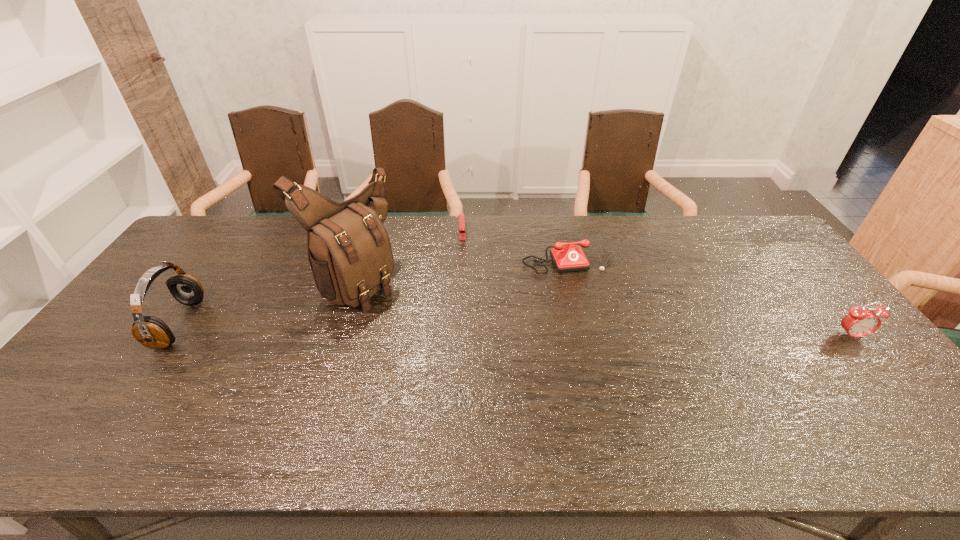
This screenshot has width=960, height=540. What are the coordinates of `vacant space on the desktop that is between the headset and the alarm clock and is positioned on the front-facing side of the stapler` in the screenshot? It's located at click(x=467, y=329).

Find the location of a particular element. This screenshot has width=960, height=540. free spot on the desktop that is between the headset and the rightmost object and is positioned on the front-facing side of the shoulder bag is located at coordinates (452, 329).

Where is `free space on the desktop that is between the headset and the third tallest object and is positioned on the dial of the telephone`? The width and height of the screenshot is (960, 540). free space on the desktop that is between the headset and the third tallest object and is positioned on the dial of the telephone is located at coordinates coord(602,332).